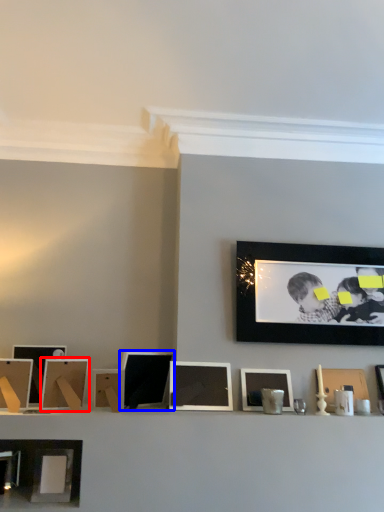
Question: Which of the following is the farthest to the observer, picture frame (highlighted by a red box) or picture frame (highlighted by a blue box)?

Choices:
 (A) picture frame
 (B) picture frame

Answer: (B)